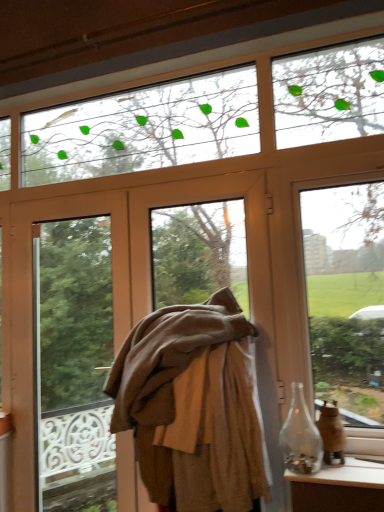
Question: Considering the relative positions of translucent glass vase at right and brown fabric at center in the image provided, is translucent glass vase at right to the right of brown fabric at center from the viewer's perspective?

Choices:
 (A) yes
 (B) no

Answer: (A)

Question: From the image's perspective, is translucent glass vase at right under brown fabric at center?

Choices:
 (A) yes
 (B) no

Answer: (A)

Question: Does translucent glass vase at right lie behind brown fabric at center?

Choices:
 (A) no
 (B) yes

Answer: (A)

Question: Considering the relative sizes of translucent glass vase at right and brown fabric at center in the image provided, is translucent glass vase at right smaller than brown fabric at center?

Choices:
 (A) no
 (B) yes

Answer: (B)

Question: Are translucent glass vase at right and brown fabric at center far apart?

Choices:
 (A) yes
 (B) no

Answer: (B)

Question: Is brown woolen coat at center situated inside transparent glass bottle at lower right or outside?

Choices:
 (A) inside
 (B) outside

Answer: (B)

Question: Considering the positions of brown woolen coat at center and transparent glass bottle at lower right in the image, is brown woolen coat at center bigger or smaller than transparent glass bottle at lower right?

Choices:
 (A) small
 (B) big

Answer: (B)

Question: From a real-world perspective, is brown woolen coat at center physically located above or below transparent glass bottle at lower right?

Choices:
 (A) below
 (B) above

Answer: (B)

Question: In the image, is brown woolen coat at center positioned in front of or behind transparent glass bottle at lower right?

Choices:
 (A) front
 (B) behind

Answer: (A)

Question: Based on their sizes in the image, would you say brown fabric at center is bigger or smaller than brown woolen coat at center?

Choices:
 (A) small
 (B) big

Answer: (A)

Question: Is brown fabric at center taller or shorter than brown woolen coat at center?

Choices:
 (A) tall
 (B) short

Answer: (A)

Question: Is point (124, 297) positioned closer to the camera than point (145, 372)?

Choices:
 (A) farther
 (B) closer

Answer: (A)

Question: From a real-world perspective, is brown fabric at center positioned above or below brown woolen coat at center?

Choices:
 (A) below
 (B) above

Answer: (B)

Question: From a real-world perspective, is translucent glass vase at right positioned above or below brown woolen coat at center?

Choices:
 (A) above
 (B) below

Answer: (B)

Question: From the image's perspective, is translucent glass vase at right above or below brown woolen coat at center?

Choices:
 (A) below
 (B) above

Answer: (A)